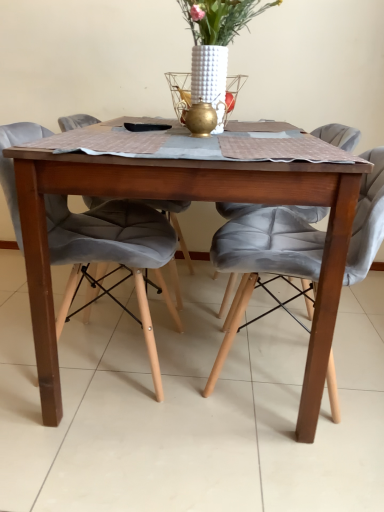
Question: From a real-world perspective, is white textured vase at center physically located above or below velvet grey chair at center, which is counted as the first chair, starting from the left?

Choices:
 (A) above
 (B) below

Answer: (A)

Question: From the image's perspective, is white textured vase at center above or below velvet grey chair at center, which is counted as the first chair, starting from the left?

Choices:
 (A) below
 (B) above

Answer: (B)

Question: Which object is positioned closest to the white textured vase at center?

Choices:
 (A) velvet grey chair at center, which is counted as the first chair, starting from the left
 (B) velvet grey chair at center, placed as the second chair when sorted from left to right
 (C) wooden table at center

Answer: (B)

Question: Estimate the real-world distances between objects in this image. Which object is farther from the white textured vase at center?

Choices:
 (A) wooden table at center
 (B) velvet grey chair at center, placed as the second chair when sorted from left to right
 (C) velvet grey chair at center, the second chair positioned from the right

Answer: (A)